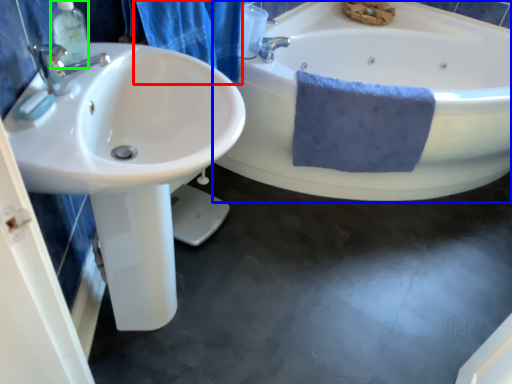
Question: Which object is positioned farthest from shower curtain (highlighted by a red box)? Select from bathtub (highlighted by a blue box) and soap dispenser (highlighted by a green box).

Choices:
 (A) bathtub
 (B) soap dispenser

Answer: (A)